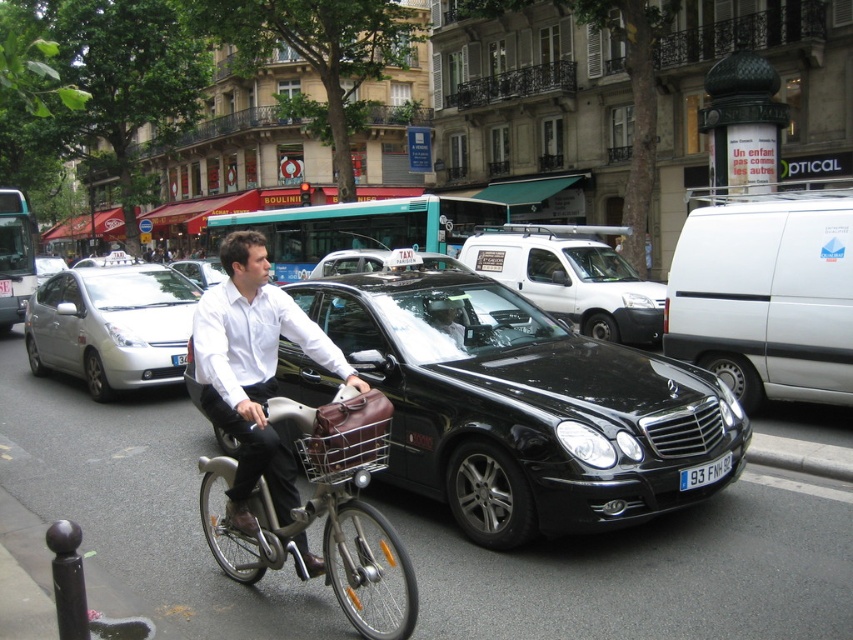
Is silver metallic hatchback at left above metallic silver basket at center?

Yes.

Does point (152, 280) come in front of point (376, 432)?

That is False.

Find the location of a particular element. The image size is (853, 640). silver metallic hatchback at left is located at coordinates (111, 326).

Measure the distance between matte white shirt at center and silver metallic hatchback at left.

matte white shirt at center and silver metallic hatchback at left are 6.01 meters apart from each other.

Does point (271, 497) come farther from viewer compared to point (140, 268)?

No, it is not.

You are a GUI agent. You are given a task and a screenshot of the screen. Output one action in this format:
    pyautogui.click(x=<x>, y=<y>)
    Task: Click on the matte white shirt at center
    The height and width of the screenshot is (640, 853).
    Given the screenshot: What is the action you would take?
    pyautogui.click(x=253, y=371)

Is black glossy sedan at center below white matte van at center?

Correct, black glossy sedan at center is located below white matte van at center.

Who is more distant from viewer, [419,275] or [556,284]?

Positioned behind is point [556,284].

Who is more distant from viewer, (x=657, y=424) or (x=563, y=273)?

Point (x=563, y=273)

You are a GUI agent. You are given a task and a screenshot of the screen. Output one action in this format:
    pyautogui.click(x=<x>, y=<y>)
    Task: Click on the black glossy sedan at center
    This screenshot has width=853, height=640.
    Given the screenshot: What is the action you would take?
    pyautogui.click(x=524, y=404)